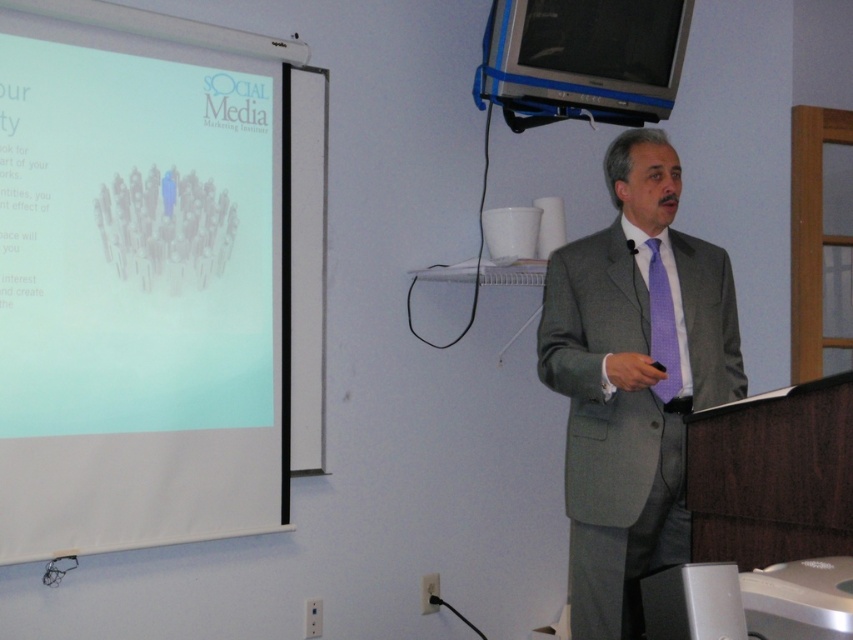
Which of these two, white matte projection screen at left or satin silver speaker at lower right, stands shorter?

satin silver speaker at lower right

Is white matte projection screen at left smaller than satin silver speaker at lower right?

Actually, white matte projection screen at left might be larger than satin silver speaker at lower right.

The width and height of the screenshot is (853, 640). I want to click on white matte projection screen at left, so click(137, 280).

Can you confirm if satin silver speaker at lower right is positioned to the left of purple dotted tie at center?

Indeed, satin silver speaker at lower right is positioned on the left side of purple dotted tie at center.

This screenshot has height=640, width=853. Describe the element at coordinates (693, 602) in the screenshot. I see `satin silver speaker at lower right` at that location.

At what (x,y) coordinates should I click in order to perform the action: click on satin silver speaker at lower right. Please return your answer as a coordinate pair (x, y). Looking at the image, I should click on (693, 602).

Is gray suit at center closer to camera compared to purple dotted tie at center?

Yes.

Between point (540, 352) and point (672, 360), which one is positioned behind?

The point (540, 352) is behind.

Identify the location of gray suit at center. This screenshot has height=640, width=853. (x=633, y=380).

In order to click on gray suit at center in this screenshot , I will do `click(633, 380)`.